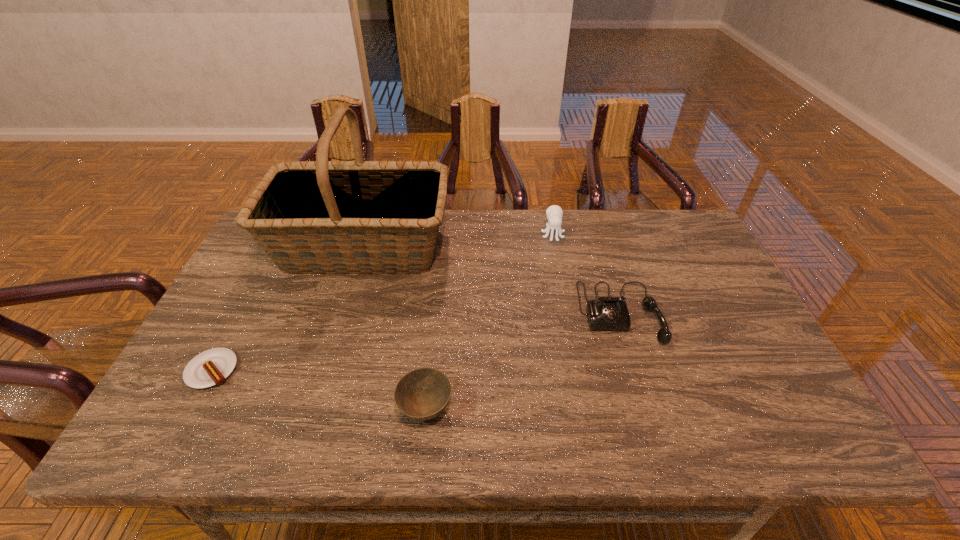
Locate an element on the screen. basket at the far edge is located at coordinates (311, 217).

Image resolution: width=960 pixels, height=540 pixels. What are the coordinates of `octopus located in the far edge section of the desktop` in the screenshot? It's located at (554, 213).

This screenshot has height=540, width=960. I want to click on object that is at the near edge, so click(x=421, y=394).

At what (x,y) coordinates should I click in order to perform the action: click on basket that is at the left edge. Please return your answer as a coordinate pair (x, y). The width and height of the screenshot is (960, 540). Looking at the image, I should click on (311, 217).

Locate an element on the screen. sausage situated at the left edge is located at coordinates (211, 367).

Locate an element on the screen. object present at the far left corner is located at coordinates (311, 217).

The image size is (960, 540). Find the location of `free space at the far edge of the desktop`. free space at the far edge of the desktop is located at coordinates (631, 216).

Where is `vacant space at the near edge`? The width and height of the screenshot is (960, 540). vacant space at the near edge is located at coordinates (394, 430).

In the image, there is a desktop. Where is `vacant space at the left edge`? This screenshot has height=540, width=960. vacant space at the left edge is located at coordinates point(224,327).

Where is `free space at the right edge of the desktop`? free space at the right edge of the desktop is located at coordinates (690, 325).